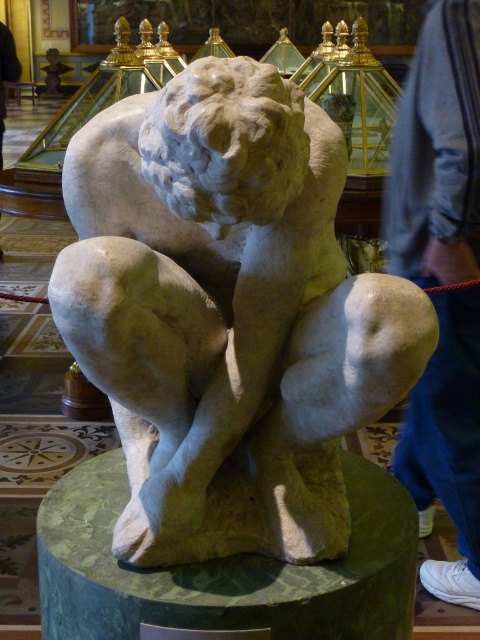
Is white marble lion at center positioned at the back of blue jeans at lower right?

No, white marble lion at center is closer to the viewer.

Which is behind, point (232, 442) or point (476, 397)?

Point (476, 397)

At what (x,y) coordinates should I click in order to perform the action: click on white marble lion at center. Please return your answer as a coordinate pair (x, y). The image size is (480, 640). Looking at the image, I should click on (228, 314).

Can you confirm if white marble lion at center is bigger than green marble pedestal at center?

Yes, white marble lion at center is bigger than green marble pedestal at center.

Does white marble lion at center have a smaller size compared to green marble pedestal at center?

Incorrect, white marble lion at center is not smaller in size than green marble pedestal at center.

Is point (57, 294) positioned after point (369, 634)?

That is False.

The width and height of the screenshot is (480, 640). What are the coordinates of `white marble lion at center` in the screenshot? It's located at (228, 314).

Is green marble pedestal at center to the left of blue jeans at lower right from the viewer's perspective?

Indeed, green marble pedestal at center is positioned on the left side of blue jeans at lower right.

Between green marble pedestal at center and blue jeans at lower right, which one is positioned lower?

Positioned lower is green marble pedestal at center.

Between point (288, 592) and point (448, 584), which one is positioned in front?

Point (288, 592) is in front.

Locate an element on the screen. green marble pedestal at center is located at coordinates (225, 570).